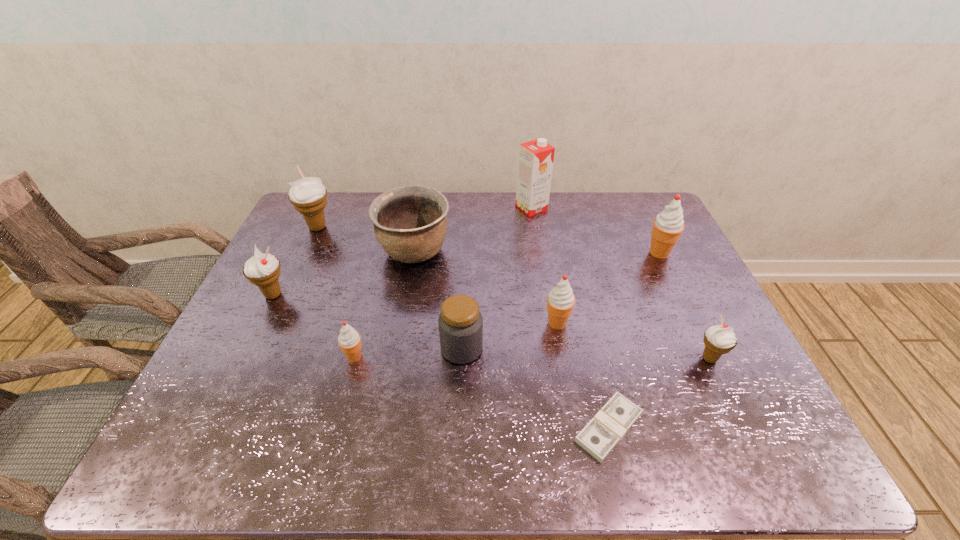
Identify the location of vacant area that lies between the rightmost white icecream and the biggest white icecream. pos(514,293).

This screenshot has width=960, height=540. I want to click on vacant space that is in between the rightmost white icecream and the farthest red icecream, so click(684, 306).

Find the location of a particular element. This screenshot has height=540, width=960. vacant point located between the farthest object and the pottery is located at coordinates (473, 230).

Find the location of a particular element. The image size is (960, 540). vacant area between the pottery and the biggest red icecream is located at coordinates (537, 253).

Locate an element on the screen. unoccupied area between the biggest white icecream and the biggest red icecream is located at coordinates (489, 240).

Find the location of a particular element. free space between the fourth nearest icecream and the jar is located at coordinates (368, 322).

Point out which object is positioned as the fifth nearest to the gray jar. Please provide its 2D coordinates. Your answer should be formatted as a tuple, i.e. [(x, y)], where the tuple contains the x and y coordinates of a point satisfying the conditions above.

[(263, 270)]

This screenshot has width=960, height=540. I want to click on object that stands as the sixth closest to the nearest red icecream, so click(x=611, y=423).

The width and height of the screenshot is (960, 540). I want to click on icecream that is the fifth closest to the tallest object, so click(x=349, y=340).

Image resolution: width=960 pixels, height=540 pixels. Find the location of `the closest icecream relative to the gray jar`. the closest icecream relative to the gray jar is located at coordinates [560, 301].